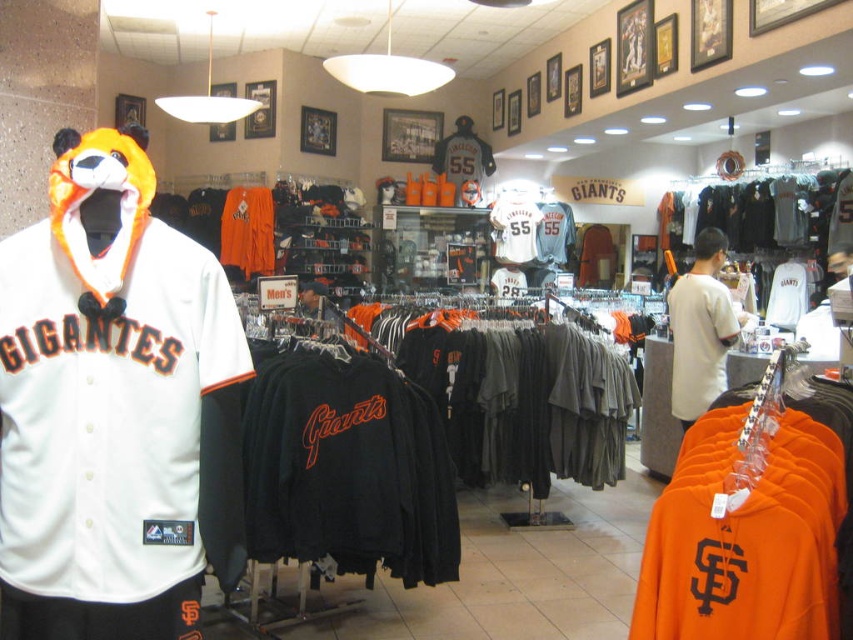
Question: Can you confirm if white cotton t-shirt at center is thinner than orange jersey at center?

Choices:
 (A) yes
 (B) no

Answer: (A)

Question: Can you confirm if white jersey at left is bigger than white cotton t-shirt at center?

Choices:
 (A) yes
 (B) no

Answer: (B)

Question: Estimate the real-world distances between objects in this image. Which object is closer to the white jersey at left?

Choices:
 (A) orange jersey at center
 (B) white cotton t-shirt at center
 (C) black jersey at center

Answer: (C)

Question: Which object is positioned closest to the black jersey at center?

Choices:
 (A) white cotton t-shirt at center
 (B) orange jersey at center
 (C) white jersey at left

Answer: (A)

Question: Which object is the farthest from the white cotton t-shirt at center?

Choices:
 (A) black jersey at center
 (B) white jersey at left
 (C) orange jersey at center

Answer: (C)

Question: Can you confirm if black jersey at center is bigger than orange jersey at center?

Choices:
 (A) yes
 (B) no

Answer: (A)